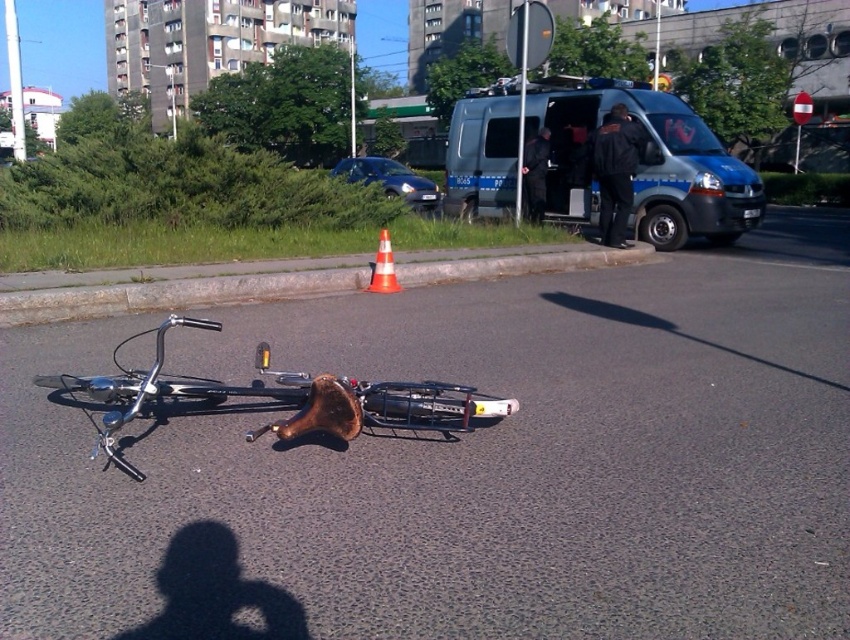
Question: Which object appears farthest from the camera in this image?

Choices:
 (A) orange plastic traffic cone at center
 (B) concrete curb at lower center

Answer: (A)

Question: Is blue metallic van at center thinner than concrete curb at lower center?

Choices:
 (A) no
 (B) yes

Answer: (B)

Question: Among these points, which one is farthest from the camera?

Choices:
 (A) (389, 385)
 (B) (298, 282)

Answer: (B)

Question: Which object is closer to the camera taking this photo?

Choices:
 (A) blue metallic van at center
 (B) orange plastic traffic cone at center
 (C) concrete curb at lower center

Answer: (C)

Question: Can you confirm if blue metallic van at center is smaller than orange plastic traffic cone at center?

Choices:
 (A) no
 (B) yes

Answer: (A)

Question: Does shiny metallic bicycle at lower center lie in front of orange plastic traffic cone at center?

Choices:
 (A) yes
 (B) no

Answer: (A)